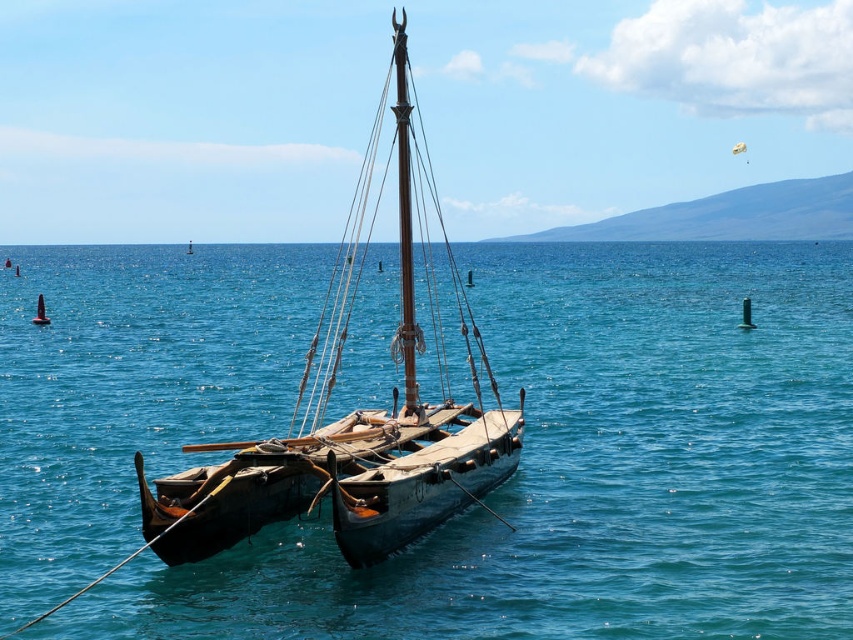
Does transparent wooden boat at center appear on the left side of wooden sailboat at center?

Yes, transparent wooden boat at center is to the left of wooden sailboat at center.

Can you confirm if transparent wooden boat at center is positioned below wooden sailboat at center?

Yes.

Between point (260, 326) and point (430, 269), which one is positioned behind?

The point (430, 269) is more distant.

Where is `transparent wooden boat at center`? The height and width of the screenshot is (640, 853). transparent wooden boat at center is located at coordinates (590, 470).